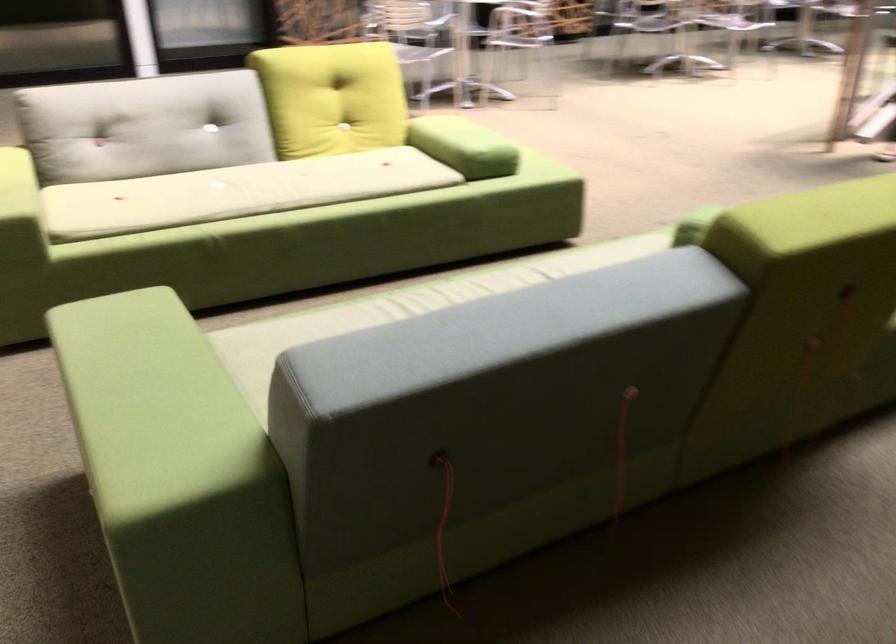
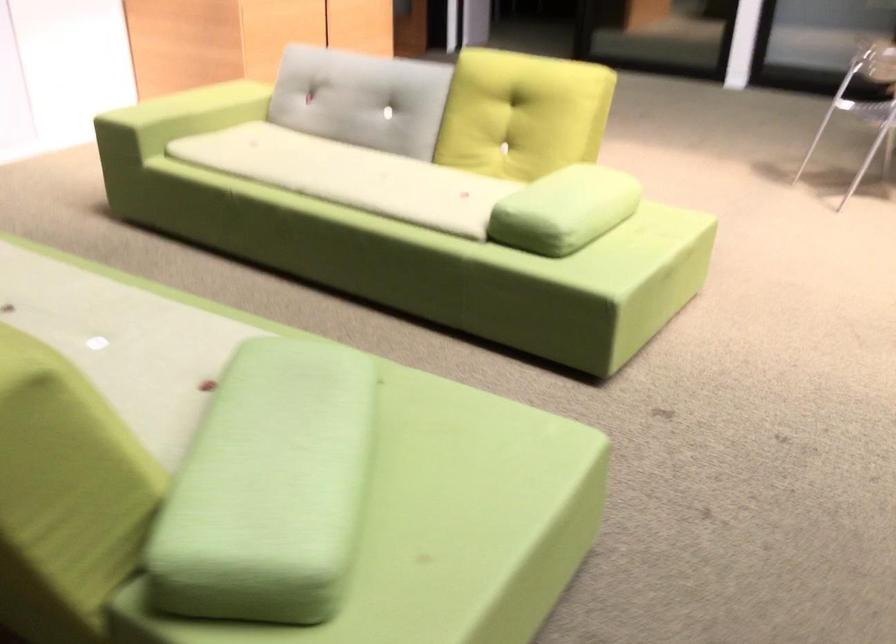
Find the pixel in the second image that matches point 504,136 in the first image.

(564, 210)